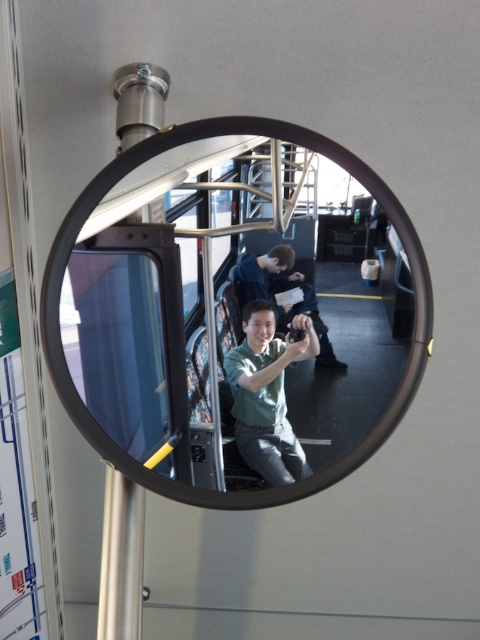
Question: Is green matte shirt at center positioned in front of matte green shirt at center?

Choices:
 (A) yes
 (B) no

Answer: (A)

Question: Which object is the farthest from the green matte shirt at center?

Choices:
 (A) transparent glass window at center
 (B) matte green shirt at center

Answer: (A)

Question: Does green matte shirt at center have a lesser width compared to matte green shirt at center?

Choices:
 (A) no
 (B) yes

Answer: (B)

Question: Which object is positioned closest to the transparent glass window at center?

Choices:
 (A) black reflective mirror at center
 (B) green matte shirt at center
 (C) matte green shirt at center

Answer: (A)

Question: Which object appears closest to the camera in this image?

Choices:
 (A) matte green shirt at center
 (B) black reflective mirror at center
 (C) green matte shirt at center

Answer: (B)

Question: Is green matte shirt at center to the left of matte green shirt at center from the viewer's perspective?

Choices:
 (A) no
 (B) yes

Answer: (B)